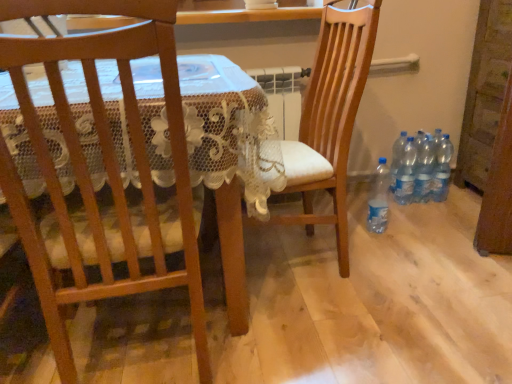
Question: Is clear plastic bottle at lower right, which appears as the 1th bottle when viewed from the left, situated inside clear plastic bottles at lower right, the 3th bottle from the right, or outside?

Choices:
 (A) outside
 (B) inside

Answer: (A)

Question: From a real-world perspective, is clear plastic bottle at lower right, which appears as the 1th bottle when viewed from the left, positioned above or below clear plastic bottles at lower right, the 3th bottle from the right?

Choices:
 (A) above
 (B) below

Answer: (B)

Question: Which of these objects is positioned closest to the clear plastic bottles at lower right, which is counted as the 4th bottle, starting from the left?

Choices:
 (A) clear plastic bottles at lower right, the 5th bottle positioned from the left
 (B) clear plastic bottle at lower right, which appears as the 5th bottle when viewed from the right
 (C) clear plastic bottles at lower right, placed as the fourth bottle when sorted from right to left
 (D) wooden chair at left, the 2th chair in the right-to-left sequence
 (E) wooden chair at center, which is counted as the 1th chair, starting from the right

Answer: (A)

Question: Considering the real-world distances, which object is farthest from the wooden chair at center, which is counted as the 1th chair, starting from the right?

Choices:
 (A) wooden chair at left, which appears as the first chair when viewed from the left
 (B) clear plastic bottles at lower right, placed as the fourth bottle when sorted from right to left
 (C) clear plastic bottle at lower right, which appears as the 1th bottle when viewed from the left
 (D) clear plastic bottles at lower right, which is counted as the 4th bottle, starting from the left
 (E) clear plastic bottles at lower right, the third bottle from the left

Answer: (D)